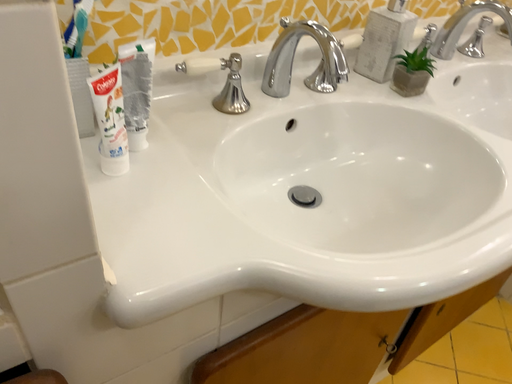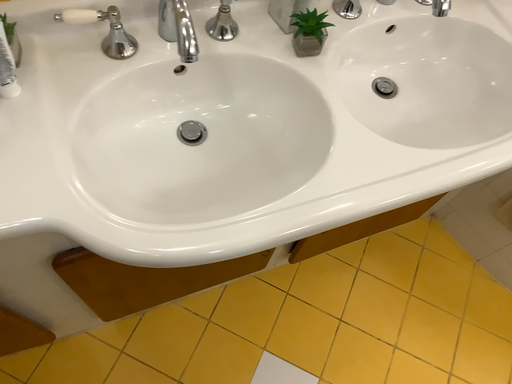
Question: Which way did the camera rotate in the video?

Choices:
 (A) rotated right
 (B) rotated left

Answer: (B)